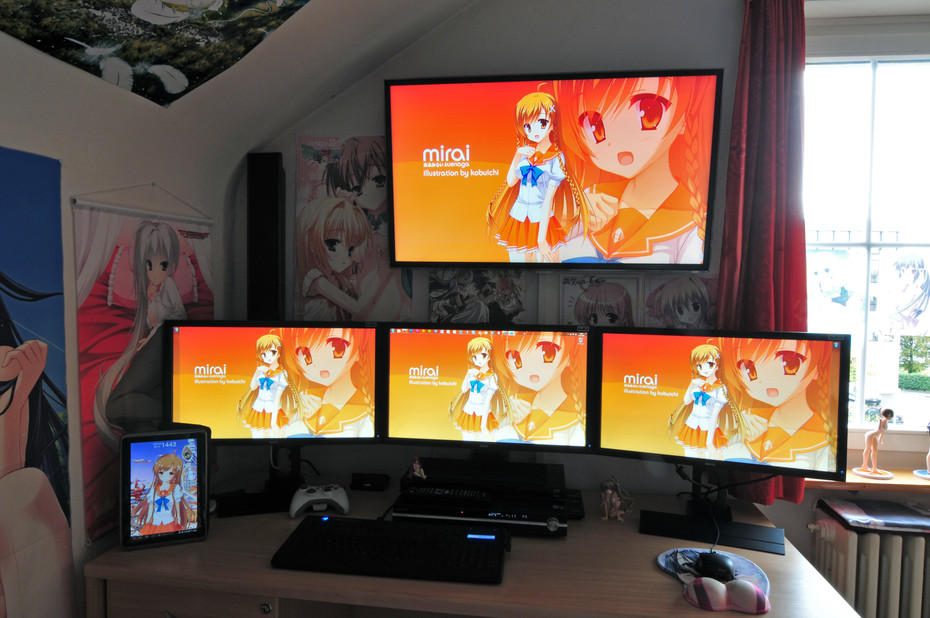
Where is `wall`? wall is located at coordinates (631, 15).